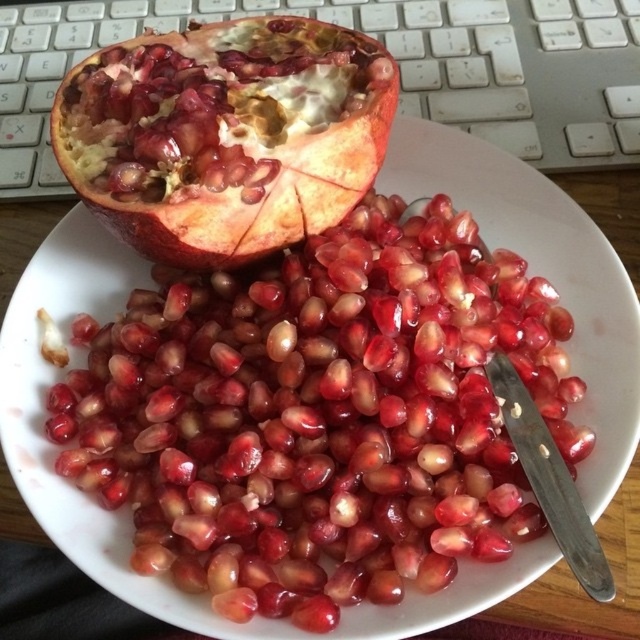
Where is `shiny red pomegranate seeds at center`? shiny red pomegranate seeds at center is located at coordinates (328, 419).

Does shiny red pomegranate seeds at center have a larger size compared to matte red pomegranate at upper left?

Correct, shiny red pomegranate seeds at center is larger in size than matte red pomegranate at upper left.

Identify the location of shiny red pomegranate seeds at center. (328, 419).

You are a GUI agent. You are given a task and a screenshot of the screen. Output one action in this format:
    pyautogui.click(x=<x>, y=<y>)
    Task: Click on the shiny red pomegranate seeds at center
    
    Given the screenshot: What is the action you would take?
    pyautogui.click(x=328, y=419)

Who is more forward, (380,301) or (480,3)?

Point (380,301) is more forward.

Is the position of shiny red pomegranate seeds at center more distant than that of white plastic keyboard at upper center?

No, shiny red pomegranate seeds at center is closer to the viewer.

This screenshot has width=640, height=640. I want to click on shiny red pomegranate seeds at center, so click(x=328, y=419).

Find the location of `matte red pomegranate at upper left`. matte red pomegranate at upper left is located at coordinates (225, 134).

Is point (200, 186) more distant than point (10, 6)?

No, it is not.

Where is `matte red pomegranate at upper left`? The width and height of the screenshot is (640, 640). matte red pomegranate at upper left is located at coordinates (225, 134).